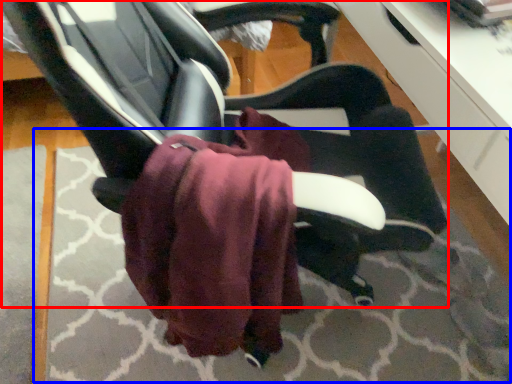
Question: Which of the following is the farthest to the observer, chair (highlighted by a red box) or mat (highlighted by a blue box)?

Choices:
 (A) chair
 (B) mat

Answer: (B)